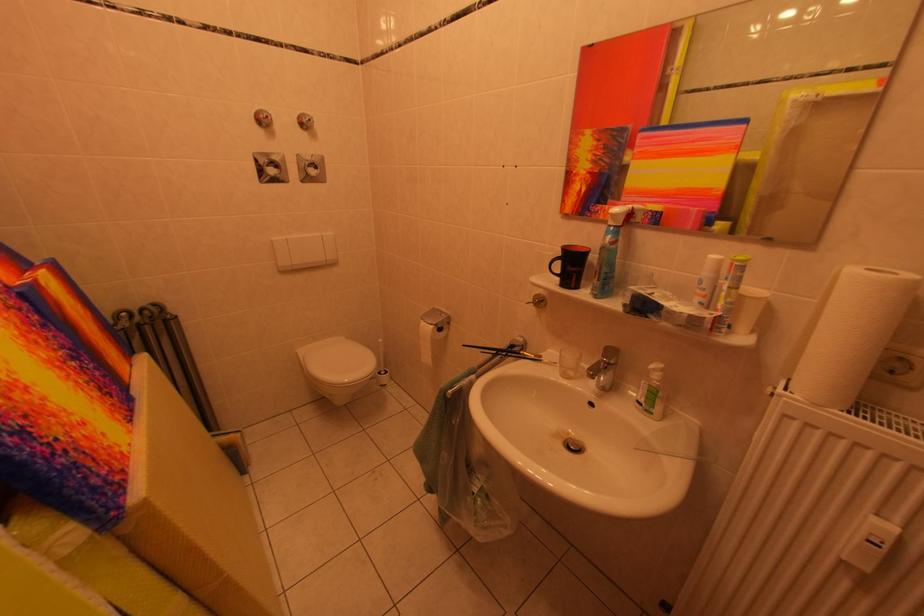
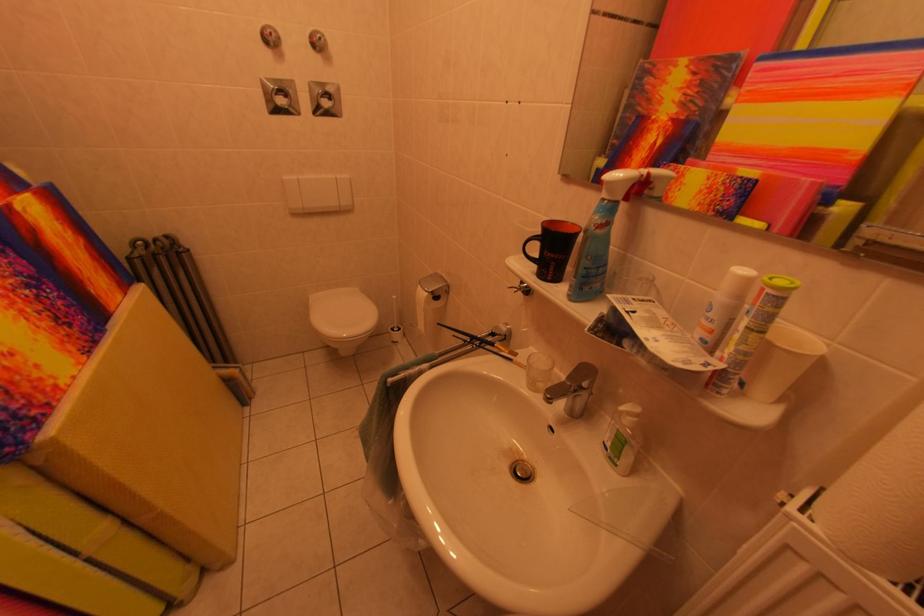
In the second image, find the point that corresponds to [567,284] in the first image.

(543, 270)